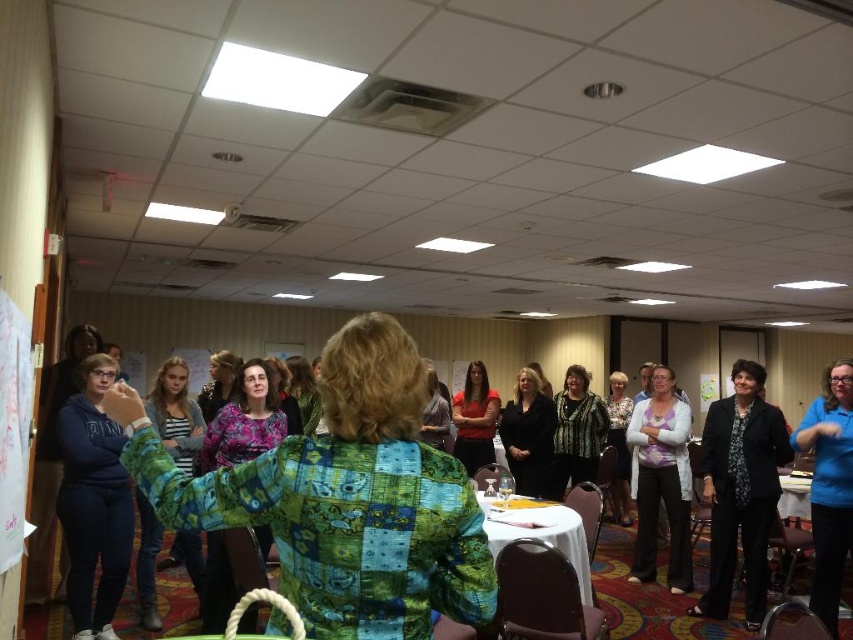
Question: Is patterned fabric blouse at center below white cloth-covered table at center?

Choices:
 (A) no
 (B) yes

Answer: (A)

Question: Which object is farther from the camera taking this photo?

Choices:
 (A) purple satin blouse at center
 (B) white textured sweater at center
 (C) black fabric dress at center
 (D) white cloth-covered table at center

Answer: (C)

Question: Which object is farther from the camera taking this photo?

Choices:
 (A) patterned blouse at center
 (B) green patchwork shirt at center
 (C) striped fabric shirt at left

Answer: (A)

Question: Does purple satin blouse at center have a lesser width compared to matte black shirt at center?

Choices:
 (A) yes
 (B) no

Answer: (A)

Question: Among these points, which one is farthest from the camera?

Choices:
 (A) (474, 410)
 (B) (836, 422)
 (C) (614, 388)

Answer: (C)

Question: Can you confirm if patterned blouse at center is positioned above floral blouse at center?

Choices:
 (A) no
 (B) yes

Answer: (A)